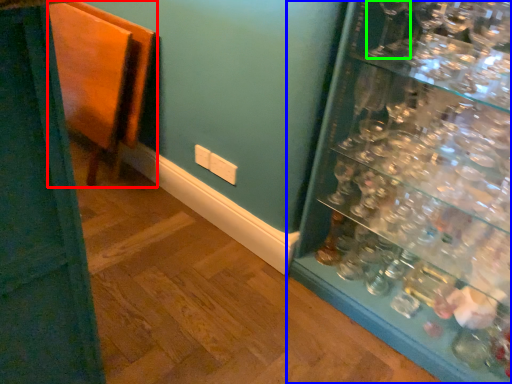
Question: Which object is the farthest from furniture (highlighted by a red box)? Choose among these: shelf (highlighted by a blue box) or wine glass (highlighted by a green box).

Choices:
 (A) shelf
 (B) wine glass

Answer: (B)